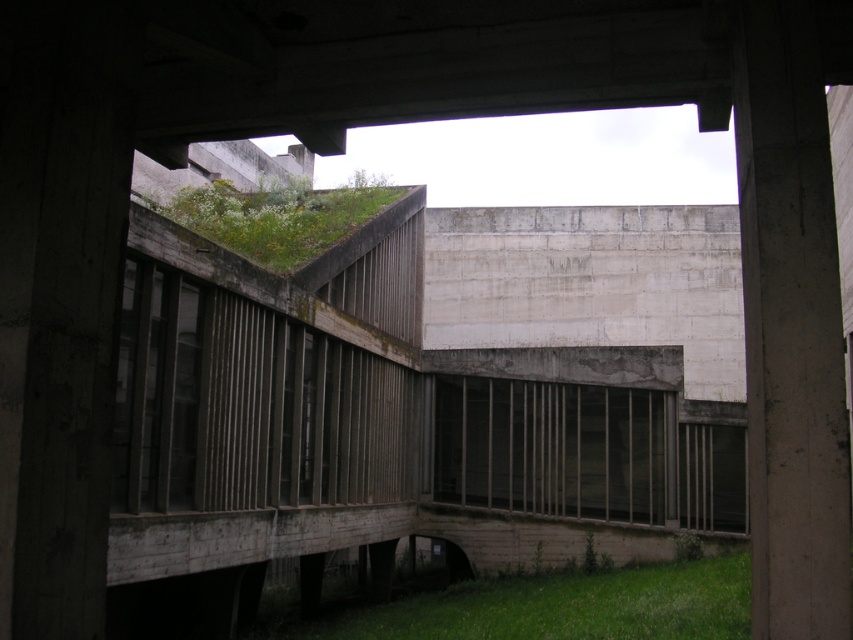
Is green grass at lower right to the right of green mossy roof at upper center from the viewer's perspective?

Result: Indeed, green grass at lower right is positioned on the right side of green mossy roof at upper center.

Who is more forward, (x=556, y=628) or (x=253, y=204)?

Point (x=556, y=628) is in front.

Find the location of a particular element. Image resolution: width=853 pixels, height=640 pixels. green grass at lower right is located at coordinates (556, 605).

Which is in front, point (759, 573) or point (456, 602)?

Point (759, 573) is more forward.

Identify the location of gray concrete pillar at right. pyautogui.click(x=790, y=324).

Locate an element on the screen. gray concrete pillar at right is located at coordinates (790, 324).

Can you confirm if gray concrete pillar at right is positioned below green mossy roof at upper center?

Yes, gray concrete pillar at right is below green mossy roof at upper center.

Between gray concrete pillar at right and green mossy roof at upper center, which one appears on the right side from the viewer's perspective?

gray concrete pillar at right is more to the right.

Is point (791, 54) more distant than point (310, 196)?

No, it is not.

The width and height of the screenshot is (853, 640). I want to click on gray concrete pillar at right, so click(790, 324).